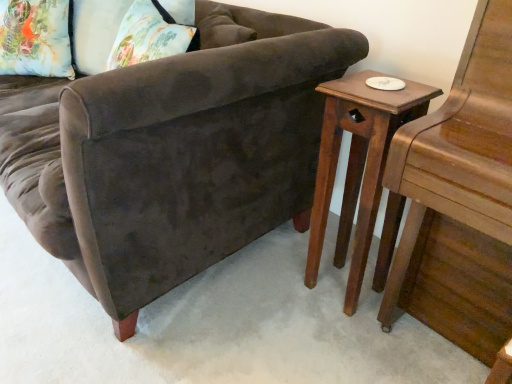
Question: From a real-world perspective, is floral fabric pillow at upper left physically located above or below wooden side table at right?

Choices:
 (A) below
 (B) above

Answer: (B)

Question: Is floral fabric pillow at upper left inside the boundaries of wooden side table at right, or outside?

Choices:
 (A) outside
 (B) inside

Answer: (A)

Question: Which object is positioned closest to the velvet brown couch at center?

Choices:
 (A) floral fabric pillow at upper left
 (B) wooden side table at right

Answer: (B)

Question: Estimate the real-world distances between objects in this image. Which object is closer to the wooden side table at right?

Choices:
 (A) velvet brown couch at center
 (B) floral fabric pillow at upper left

Answer: (A)